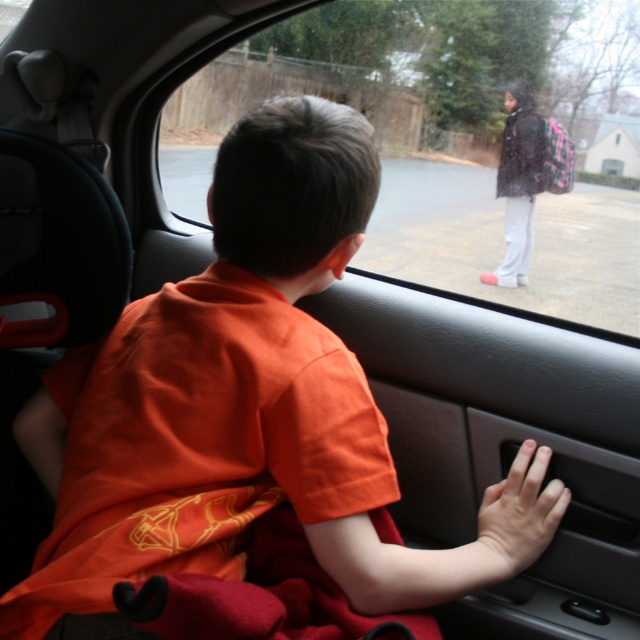
You are a passenger in a car and want to look outside through the transparent glass car window at center. Based on its position coordinates, can you estimate where exactly it is located in the car?

The transparent glass car window at center is located at coordinates point [440,145], which places it in the central area of the car window.

You are a safety inspector checking the car. You notice the black matte car door handle at lower right and the smooth skin hand at lower right. Which object is positioned lower in the car door area?

The black matte car door handle at lower right is located below the smooth skin hand at lower right, so the black matte car door handle at lower right is positioned lower in the car door area.

You are a child who wants to grab the black matte car door handle at lower right and the dark matte jacket at upper right. Which object is wider?

The dark matte jacket at upper right is wider than the black matte car door handle at lower right.